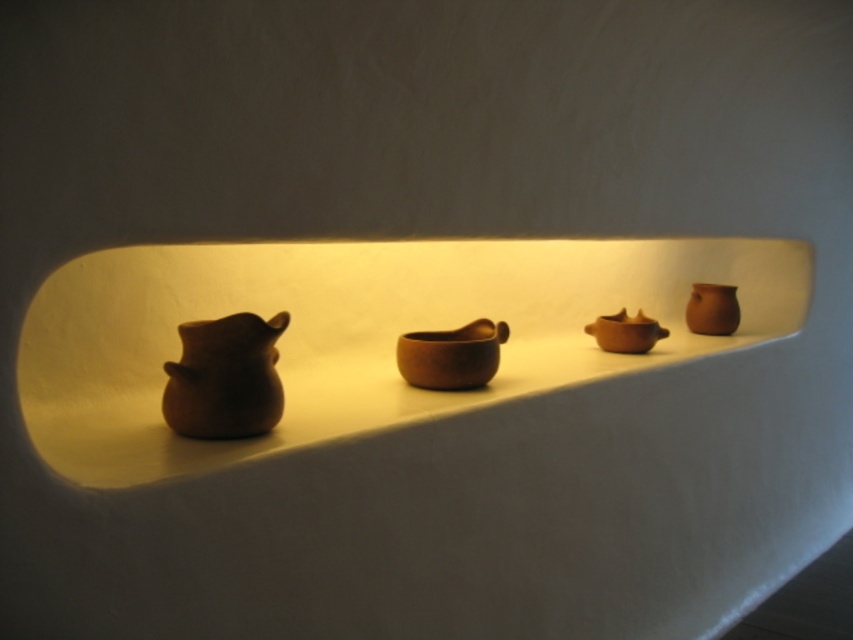
Question: Is matte brown vase at left bigger than brown matte mortar at center?

Choices:
 (A) yes
 (B) no

Answer: (B)

Question: Which point appears farthest from the camera in this image?

Choices:
 (A) (146, 316)
 (B) (602, 321)

Answer: (B)

Question: Does matte clay pots at center appear on the left side of matte brown bowl at center?

Choices:
 (A) no
 (B) yes

Answer: (B)

Question: Does matte clay pots at center appear under matte brown bowl at center?

Choices:
 (A) yes
 (B) no

Answer: (B)

Question: Which point is farther from the camera taking this photo?

Choices:
 (A) (601, 328)
 (B) (462, 333)
 (C) (227, 388)
 (D) (720, 296)

Answer: (D)

Question: Which of these objects is positioned farthest from the matte clay vase at right?

Choices:
 (A) matte brown bowl at center
 (B) brown matte mortar at center
 (C) matte clay pots at center
 (D) matte brown vase at left

Answer: (D)